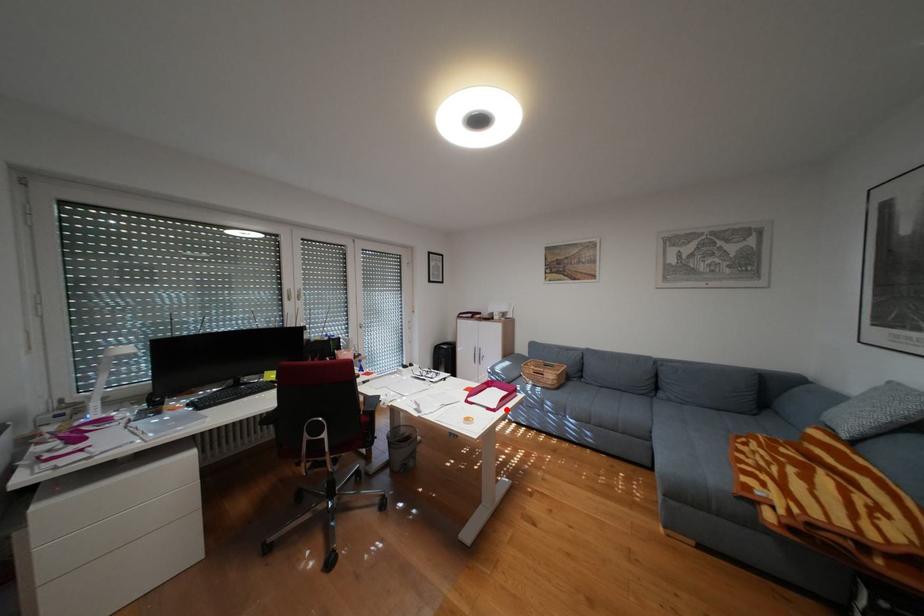
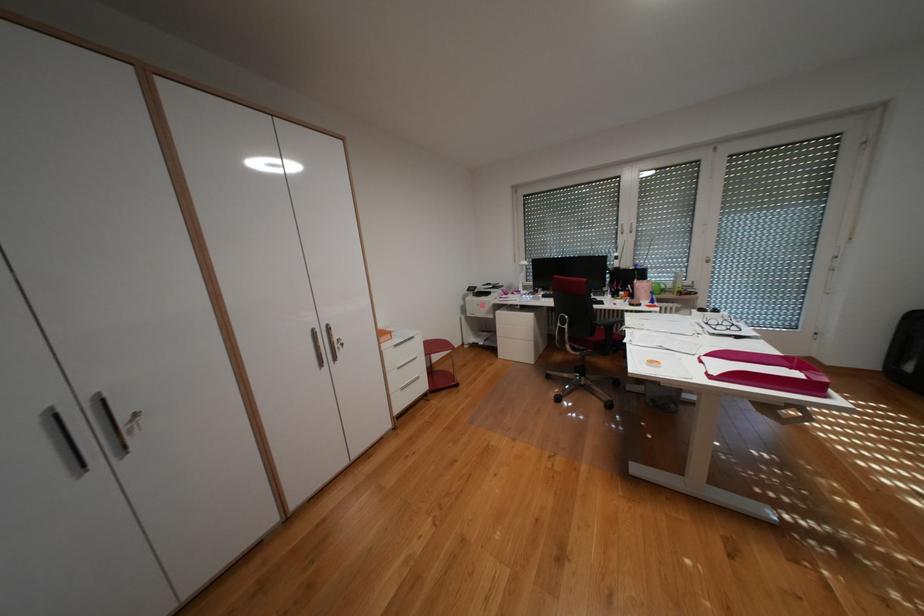
Where in the second image is the point corresponding to the highlighted location from the first image?

(723, 377)